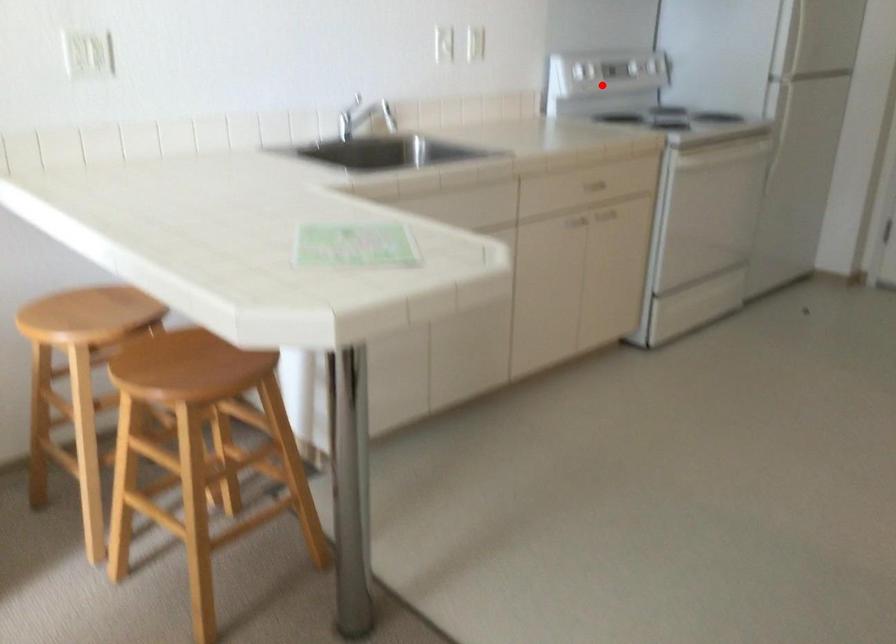
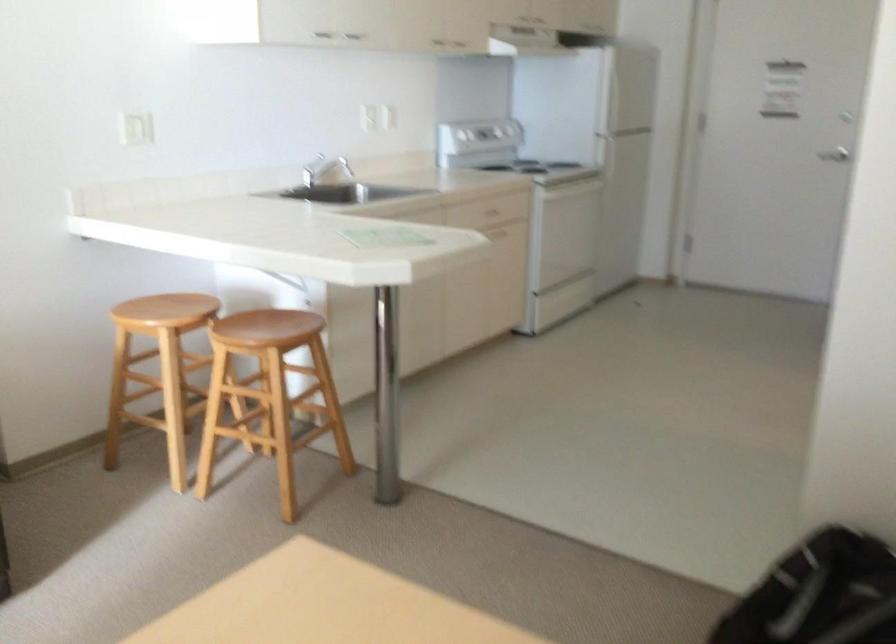
In the second image, find the point that corresponds to the highlighted location in the first image.

(478, 135)